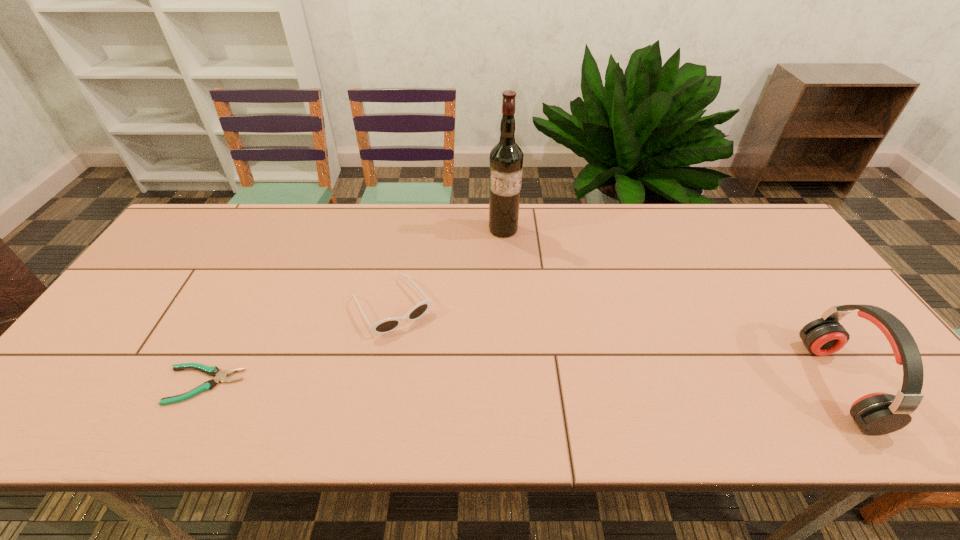
Identify the location of the shortest object. The image size is (960, 540). (220, 376).

Identify the location of the leftmost object. The image size is (960, 540). (220, 376).

Find the location of a particular element. Image resolution: width=960 pixels, height=540 pixels. the third shortest object is located at coordinates (879, 413).

Identify the location of earphone. The width and height of the screenshot is (960, 540). (879, 413).

This screenshot has width=960, height=540. What are the coordinates of `the third tallest object` in the screenshot? It's located at (385, 326).

You are a GUI agent. You are given a task and a screenshot of the screen. Output one action in this format:
    pyautogui.click(x=<x>, y=<y>)
    Task: Click on the second farthest object
    This screenshot has width=960, height=540.
    Given the screenshot: What is the action you would take?
    pyautogui.click(x=385, y=326)

This screenshot has height=540, width=960. What are the coordinates of `the tallest object` in the screenshot? It's located at (506, 158).

At what (x,y) coordinates should I click in order to perform the action: click on wine bottle. Please return your answer as a coordinate pair (x, y). The image size is (960, 540). Looking at the image, I should click on (506, 158).

Locate an element on the screen. The image size is (960, 540). free space located on the back of the shortest object is located at coordinates (238, 317).

Identify the location of free space located 0.110m on the ear cups of the rightmost object. 772,384.